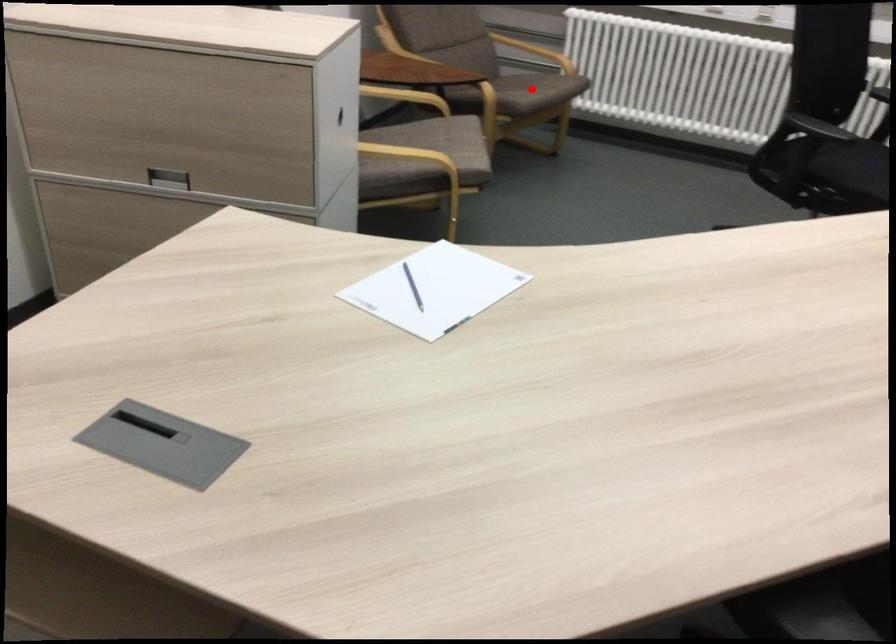
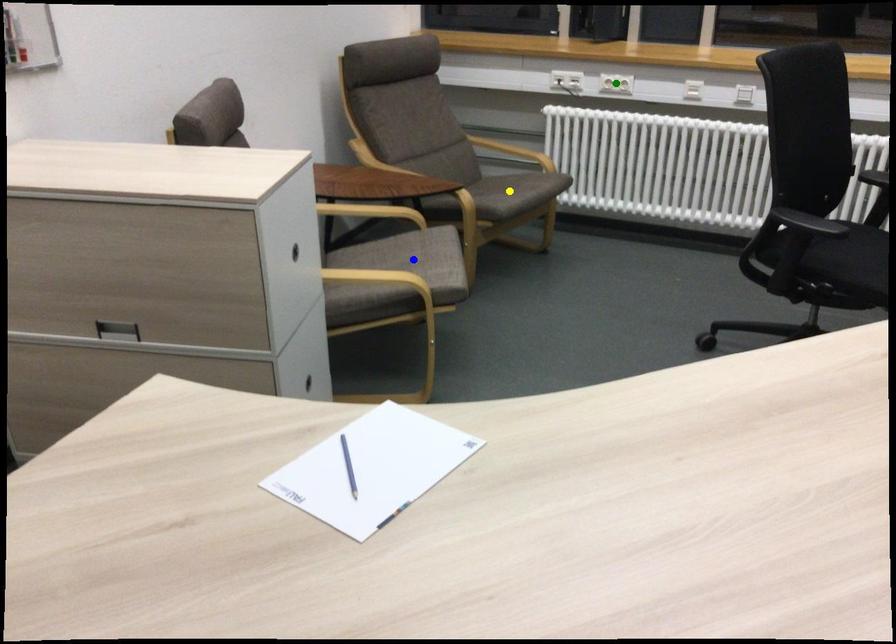
Question: I am providing you with two images of the same scene from different viewpoints. A red point is marked on the first image. You are given multiple points on the second image. In image 2, which mark is for the same physical point as the one in image 1?

Choices:
 (A) blue point
 (B) yellow point
 (C) green point

Answer: (B)